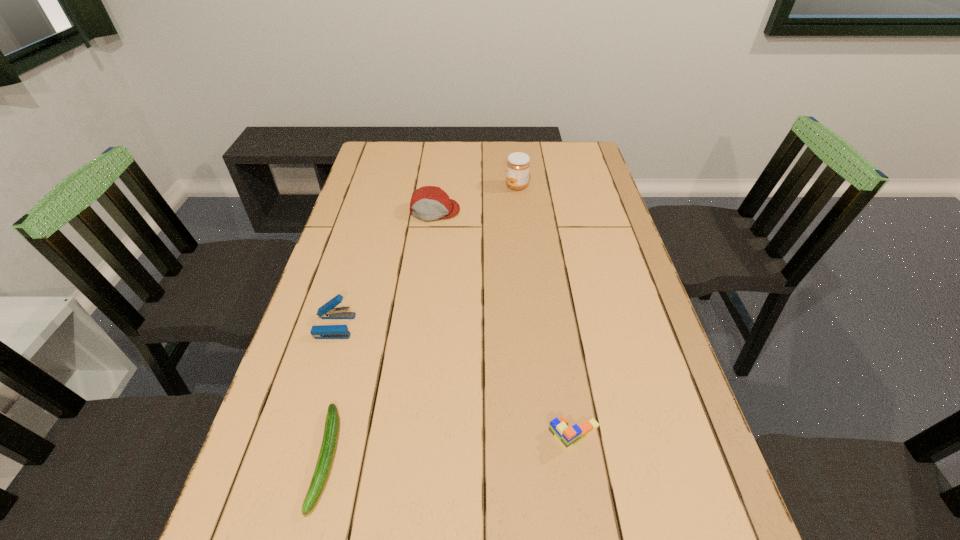
This screenshot has height=540, width=960. In order to click on free location that satisfies the following two spatial constraints: 1. on the front label of the farthest object; 2. on the back side of the fourth tallest object in this screenshot , I will do `click(544, 435)`.

Locate an element on the screen. This screenshot has height=540, width=960. free space that satisfies the following two spatial constraints: 1. on the front label of the tallest object; 2. on the front-facing side of the zucchini is located at coordinates (547, 458).

The image size is (960, 540). Find the location of `vacant region that satisfies the following two spatial constraints: 1. on the front label of the jam; 2. on the left side of the Lego`. vacant region that satisfies the following two spatial constraints: 1. on the front label of the jam; 2. on the left side of the Lego is located at coordinates (544, 435).

Identify the location of free space that satisfies the following two spatial constraints: 1. on the front label of the tallest object; 2. on the front-facing side of the shortest object. (547, 458).

Find the location of `vacant point that satisfies the following two spatial constraints: 1. on the front label of the tallest object; 2. on the front-facing side of the shortest object`. vacant point that satisfies the following two spatial constraints: 1. on the front label of the tallest object; 2. on the front-facing side of the shortest object is located at coordinates (547, 458).